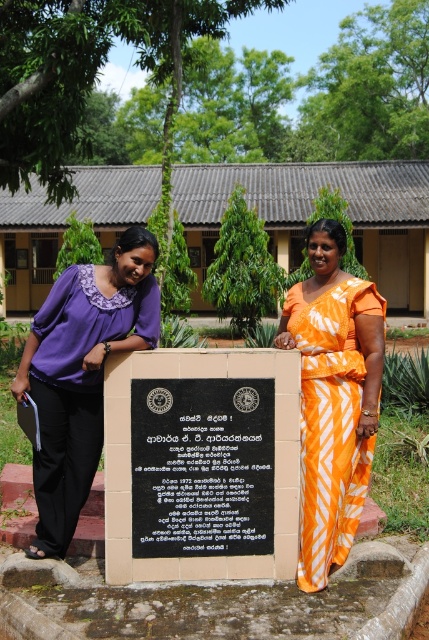
Find the location of a particular element. purple fabric blouse at left is located at coordinates (81, 374).

Is point (38, 380) in front of point (320, 316)?

Yes, point (38, 380) is closer to viewer.

This screenshot has width=429, height=640. In order to click on purple fabric blouse at left in this screenshot , I will do `click(81, 374)`.

Can you confirm if black stone plaque at center is positioned above purple fabric blouse at left?

Actually, black stone plaque at center is below purple fabric blouse at left.

Based on the photo, which of these two, black stone plaque at center or purple fabric blouse at left, stands shorter?

black stone plaque at center is shorter.

At what (x,y) coordinates should I click in order to perform the action: click on black stone plaque at center. Please return your answer as a coordinate pair (x, y). Looking at the image, I should click on (202, 467).

Is black stone plaque at center thinner than orange printed fabric dress at center?

In fact, black stone plaque at center might be wider than orange printed fabric dress at center.

Based on the photo, does black stone plaque at center appear over orange printed fabric dress at center?

No, black stone plaque at center is not above orange printed fabric dress at center.

Is point (217, 388) farther from camera compared to point (341, 390)?

No, it is in front of (341, 390).

Where is `black stone plaque at center`? black stone plaque at center is located at coordinates (202, 467).